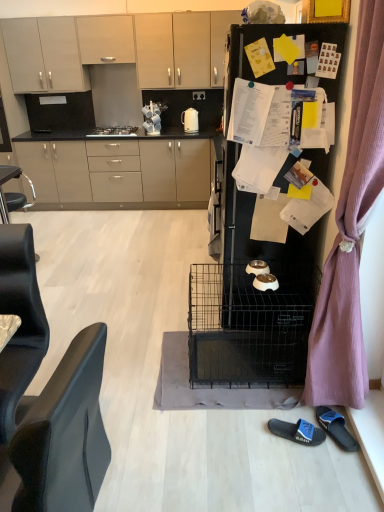
Where is `matte white cabinet at upper center, the fourth cabinetry in the bottom-to-top sequence`? matte white cabinet at upper center, the fourth cabinetry in the bottom-to-top sequence is located at coordinates (106, 39).

You are a GUI agent. You are given a task and a screenshot of the screen. Output one action in this format:
    pyautogui.click(x=<x>, y=<y>)
    Task: Click on the matte beige cabinets at center, the first cabinetry positioned from the bottom
    Image resolution: width=384 pixels, height=512 pixels.
    Given the screenshot: What is the action you would take?
    pyautogui.click(x=122, y=172)

The height and width of the screenshot is (512, 384). Describe the element at coordinates (174, 49) in the screenshot. I see `beige matte cabinet at upper center, the second cabinetry viewed from the top` at that location.

Measure the distance between beige matte cabinet at upper center, the third cabinetry from the bottom, and camera.

4.47 meters.

Image resolution: width=384 pixels, height=512 pixels. What do you see at coordinates (2, 189) in the screenshot? I see `black leather armchair at left` at bounding box center [2, 189].

Identify the location of satin silver gas stove at upper center. The width and height of the screenshot is (384, 512). (113, 131).

The width and height of the screenshot is (384, 512). I want to click on white glossy electric kettle at upper center, so click(x=190, y=121).

Identify the location of cabinetry that is the 1st one when counting forward from the satin silver gas stove at upper center. The image size is (384, 512). (122, 172).

From the image's perspective, is matte beige cabinets at center, which is the 4th cabinetry from top to bottom, above or below satin silver gas stove at upper center?

Based on their image positions, matte beige cabinets at center, which is the 4th cabinetry from top to bottom, is located beneath satin silver gas stove at upper center.

Which object is thinner, matte beige cabinets at center, the first cabinetry positioned from the bottom, or satin silver gas stove at upper center?

satin silver gas stove at upper center.

Is white glossy electric kettle at upper center further to the viewer compared to satin silver gas stove at upper center?

No, white glossy electric kettle at upper center is closer to the camera.

Between white glossy electric kettle at upper center and satin silver gas stove at upper center, which one has larger size?

Bigger between the two is satin silver gas stove at upper center.

Identify the location of kitchen appliance that appears above the satin silver gas stove at upper center (from the image's perspective). The width and height of the screenshot is (384, 512). (190, 121).

From the picture: From the image's perspective, is white glossy electric kettle at upper center located beneath satin silver gas stove at upper center?

No, from the image's perspective, white glossy electric kettle at upper center is not beneath satin silver gas stove at upper center.

How many degrees apart are the facing directions of white glossy electric kettle at upper center and blue fabric slipper at lower right, which is the second footwear in right-to-left order?

They differ by 111 degrees in their facing directions.

Is blue fabric slipper at lower right, which is the first footwear in left-to-right order, completely or partially inside white glossy electric kettle at upper center?

Actually, blue fabric slipper at lower right, which is the first footwear in left-to-right order, is outside white glossy electric kettle at upper center.

Does point (188, 123) appear closer or farther from the camera than point (270, 431)?

Point (188, 123) appears to be farther away from the viewer than point (270, 431).

From the image's perspective, does satin silver gas stove at upper center appear higher than black leather armchair at left?

Yes.

From their relative heights in the image, would you say satin silver gas stove at upper center is taller or shorter than black leather armchair at left?

Considering their sizes, satin silver gas stove at upper center has less height than black leather armchair at left.

In the scene shown: Can you confirm if satin silver gas stove at upper center is thinner than black leather armchair at left?

Indeed, satin silver gas stove at upper center has a lesser width compared to black leather armchair at left.

Does matte white cabinet at upper center, positioned as the first cabinetry in top-to-bottom order, turn towards matte gray cabinets at upper left, placed as the third cabinetry when sorted from top to bottom?

No, matte white cabinet at upper center, positioned as the first cabinetry in top-to-bottom order, does not turn towards matte gray cabinets at upper left, placed as the third cabinetry when sorted from top to bottom.

Based on the photo, from the image's perspective, is matte white cabinet at upper center, the fourth cabinetry in the bottom-to-top sequence, on top of matte gray cabinets at upper left, placed as the second cabinetry when sorted from bottom to top?

Yes, from the image's perspective, matte white cabinet at upper center, the fourth cabinetry in the bottom-to-top sequence, is on top of matte gray cabinets at upper left, placed as the second cabinetry when sorted from bottom to top.

How many degrees apart are the facing directions of matte white cabinet at upper center, positioned as the first cabinetry in top-to-bottom order, and matte gray cabinets at upper left, placed as the third cabinetry when sorted from top to bottom?

0.00104 degrees.

Considering the sizes of objects matte white cabinet at upper center, the fourth cabinetry in the bottom-to-top sequence, and matte gray cabinets at upper left, placed as the second cabinetry when sorted from bottom to top, in the image provided, who is smaller, matte white cabinet at upper center, the fourth cabinetry in the bottom-to-top sequence, or matte gray cabinets at upper left, placed as the second cabinetry when sorted from bottom to top,?

Smaller between the two is matte white cabinet at upper center, the fourth cabinetry in the bottom-to-top sequence.

Considering the positions of objects black matte refrigerator at upper right and white glossy coffee cup at upper center in the image provided, who is more to the left, black matte refrigerator at upper right or white glossy coffee cup at upper center?

Positioned to the left is white glossy coffee cup at upper center.

Is black matte refrigerator at upper right looking in the opposite direction of white glossy coffee cup at upper center?

No, black matte refrigerator at upper right's orientation is not away from white glossy coffee cup at upper center.

Which of these two, black matte refrigerator at upper right or white glossy coffee cup at upper center, is thinner?

white glossy coffee cup at upper center is thinner.

Between black matte refrigerator at upper right and white glossy coffee cup at upper center, which one is positioned behind?

Positioned behind is white glossy coffee cup at upper center.

Would you say purple fabric curtain at right is to the left or to the right of white glossy electric kettle at upper center in the picture?

In the image, purple fabric curtain at right appears on the right side of white glossy electric kettle at upper center.

At what (x,y) coordinates should I click in order to perform the action: click on curtain that appears on the right of white glossy electric kettle at upper center. Please return your answer as a coordinate pair (x, y). Looking at the image, I should click on (351, 232).

Which point is more distant from viewer, [360,62] or [194,118]?

The point [194,118] is behind.

Between purple fabric curtain at right and white glossy electric kettle at upper center, which one has larger width?

purple fabric curtain at right is wider.

Starting from the satin silver gas stove at upper center, which cabinetry is the 1st one to the right? Please provide its 2D coordinates.

[(122, 172)]

Image resolution: width=384 pixels, height=512 pixels. Find the location of `kitchen appliance in front of the satin silver gas stove at upper center`. kitchen appliance in front of the satin silver gas stove at upper center is located at coordinates (190, 121).

Considering their positions, is blue fabric slipper at lower right, which is the second footwear in right-to-left order, positioned closer to matte gray cabinets at upper left, placed as the third cabinetry when sorted from top to bottom, than black matte refrigerator at upper right?

black matte refrigerator at upper right lies closer to matte gray cabinets at upper left, placed as the third cabinetry when sorted from top to bottom, than the other object.

From the image, which object appears to be farther from white glossy electric kettle at upper center, white glossy coffee cup at upper center or satin silver gas stove at upper center?

satin silver gas stove at upper center is positioned further to the anchor white glossy electric kettle at upper center.

Looking at the image, which one is located closer to matte white cabinet at upper center, the fourth cabinetry in the bottom-to-top sequence, white glossy coffee cup at upper center or blue fabric slipper at lower right, which is the second footwear in right-to-left order?

A: Among the two, white glossy coffee cup at upper center is located nearer to matte white cabinet at upper center, the fourth cabinetry in the bottom-to-top sequence.

Considering their positions, is white glossy electric kettle at upper center positioned further to satin silver gas stove at upper center than purple fabric curtain at right?

purple fabric curtain at right.

Based on their spatial positions, is black leather armchair at left or matte white cabinet at upper center, positioned as the first cabinetry in top-to-bottom order, further from beige matte cabinet at upper center, the third cabinetry from the bottom?

black leather armchair at left lies further to beige matte cabinet at upper center, the third cabinetry from the bottom, than the other object.

Considering their positions, is white glossy electric kettle at upper center positioned further to beige matte cabinet at upper center, the second cabinetry viewed from the top, than matte gray cabinets at upper left, placed as the third cabinetry when sorted from top to bottom?

matte gray cabinets at upper left, placed as the third cabinetry when sorted from top to bottom.

Looking at the image, which one is located closer to matte beige cabinets at center, the first cabinetry positioned from the bottom, white glossy electric kettle at upper center or purple fabric curtain at right?

white glossy electric kettle at upper center.

Considering their positions, is white glossy electric kettle at upper center positioned closer to black matte refrigerator at upper right than beige matte cabinet at upper center, the third cabinetry from the bottom?

white glossy electric kettle at upper center is closer to black matte refrigerator at upper right.

This screenshot has width=384, height=512. What are the coordinates of `home appliance between matte white cabinet at upper center, positioned as the first cabinetry in top-to-bottom order, and black leather armchair at left vertically` in the screenshot? It's located at (113, 131).

Where is `home appliance between matte white cabinet at upper center, positioned as the first cabinetry in top-to-bottom order, and beige matte cabinet at upper center, the second cabinetry viewed from the top`? This screenshot has height=512, width=384. home appliance between matte white cabinet at upper center, positioned as the first cabinetry in top-to-bottom order, and beige matte cabinet at upper center, the second cabinetry viewed from the top is located at coordinates (113, 131).

Image resolution: width=384 pixels, height=512 pixels. Find the location of `appliance between matte gray cabinets at upper left, placed as the third cabinetry when sorted from top to bottom, and blue fabric slipper at lower right, which is the first footwear in left-to-right order, in the up-down direction`. appliance between matte gray cabinets at upper left, placed as the third cabinetry when sorted from top to bottom, and blue fabric slipper at lower right, which is the first footwear in left-to-right order, in the up-down direction is located at coordinates (153, 117).

Where is `appliance between blue rubber slipper at lower right, arranged as the second footwear when viewed from the left, and matte beige cabinets at center, the first cabinetry positioned from the bottom, in the front-back direction`? Image resolution: width=384 pixels, height=512 pixels. appliance between blue rubber slipper at lower right, arranged as the second footwear when viewed from the left, and matte beige cabinets at center, the first cabinetry positioned from the bottom, in the front-back direction is located at coordinates (153, 117).